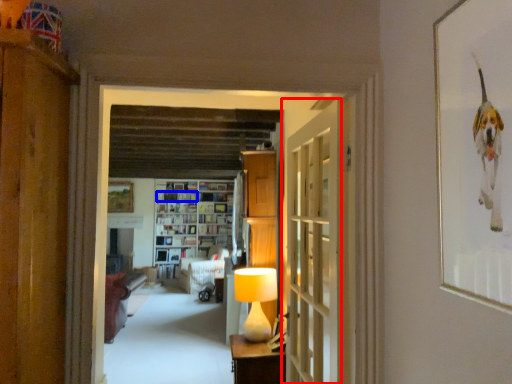
Question: Among these objects, which one is farthest to the camera, door (highlighted by a red box) or book (highlighted by a blue box)?

Choices:
 (A) door
 (B) book

Answer: (B)